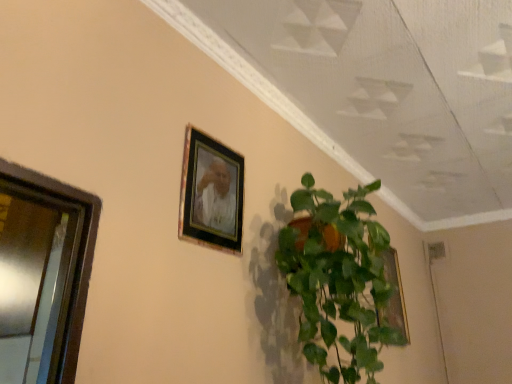
Find the location of a particular element. wooden frame at upper center, the 1th picture frame positioned from the top is located at coordinates (211, 193).

The image size is (512, 384). What are the coordinates of `metallic glass window at left` in the screenshot? It's located at (42, 274).

What do you see at coordinates (42, 274) in the screenshot? This screenshot has height=384, width=512. I see `metallic glass window at left` at bounding box center [42, 274].

Measure the distance between gold metallic picture frame at upper right, which appears as the second picture frame when viewed from the top, and camera.

The depth of gold metallic picture frame at upper right, which appears as the second picture frame when viewed from the top, is 2.12 meters.

At what (x,y) coordinates should I click in order to perform the action: click on wooden frame at upper center, the 2th picture frame from the right. Please return your answer as a coordinate pair (x, y). The width and height of the screenshot is (512, 384). Looking at the image, I should click on (211, 193).

Locate an element on the screen. picture frame above the metallic glass window at left (from the image's perspective) is located at coordinates (211, 193).

Is point (202, 187) in front of point (47, 289)?

No, (202, 187) is further to viewer.

Is wooden frame at upper center, the 1th picture frame positioned from the top, shorter than metallic glass window at left?

Yes, wooden frame at upper center, the 1th picture frame positioned from the top, is shorter than metallic glass window at left.

Does wooden frame at upper center, the 1th picture frame positioned from the top, touch metallic glass window at left?

No, wooden frame at upper center, the 1th picture frame positioned from the top, is not next to metallic glass window at left.

Based on the photo, between gold metallic picture frame at upper right, the 2th picture frame when ordered from left to right, and wooden frame at upper center, the 2th picture frame from the right, which one has larger width?

Wider between the two is wooden frame at upper center, the 2th picture frame from the right.

From the image's perspective, is gold metallic picture frame at upper right, the first picture frame viewed from the right, on wooden frame at upper center, the 2th picture frame from the right?

No.

Can you tell me how much gold metallic picture frame at upper right, which appears as the second picture frame when viewed from the top, and wooden frame at upper center, the 2th picture frame from the right, differ in facing direction?

The angular difference between gold metallic picture frame at upper right, which appears as the second picture frame when viewed from the top, and wooden frame at upper center, the 2th picture frame from the right, is 0.0299 degrees.

Between gold metallic picture frame at upper right, which is counted as the 2th picture frame, starting from the front, and wooden frame at upper center, which is the first picture frame from front to back, which one is positioned in front?

wooden frame at upper center, which is the first picture frame from front to back, is more forward.

How many degrees apart are the facing directions of green glossy plant at center and gold metallic picture frame at upper right, the first picture frame ordered from the bottom?

The facing directions of green glossy plant at center and gold metallic picture frame at upper right, the first picture frame ordered from the bottom, are 0.296 degrees apart.

Which object is further away from the camera taking this photo, green glossy plant at center or gold metallic picture frame at upper right, which is counted as the 2th picture frame, starting from the front?

gold metallic picture frame at upper right, which is counted as the 2th picture frame, starting from the front, is more distant.

Is green glossy plant at center wider than gold metallic picture frame at upper right, the first picture frame ordered from the bottom?

Indeed, green glossy plant at center has a greater width compared to gold metallic picture frame at upper right, the first picture frame ordered from the bottom.

Is green glossy plant at center taller than gold metallic picture frame at upper right, the first picture frame positioned from the back?

Yes, green glossy plant at center is taller than gold metallic picture frame at upper right, the first picture frame positioned from the back.

Is metallic glass window at left inside the boundaries of gold metallic picture frame at upper right, the 2th picture frame when ordered from left to right, or outside?

metallic glass window at left is outside gold metallic picture frame at upper right, the 2th picture frame when ordered from left to right.

Is metallic glass window at left oriented away from gold metallic picture frame at upper right, the first picture frame viewed from the right?

metallic glass window at left does not have its back to gold metallic picture frame at upper right, the first picture frame viewed from the right.

Which point is more distant from viewer, [42,228] or [395,286]?

Positioned behind is point [395,286].

Which point is more forward, (x=22, y=209) or (x=208, y=159)?

Point (x=22, y=209)

Measure the distance from metallic glass window at left to wooden frame at upper center, the 1th picture frame positioned from the left.

metallic glass window at left is 15.59 inches away from wooden frame at upper center, the 1th picture frame positioned from the left.

Is metallic glass window at left facing towards wooden frame at upper center, the 1th picture frame positioned from the top?

No, metallic glass window at left is not turned towards wooden frame at upper center, the 1th picture frame positioned from the top.

In the scene shown: From a real-world perspective, is metallic glass window at left on wooden frame at upper center, positioned as the 2th picture frame in back-to-front order?

No, from a real-world perspective, metallic glass window at left is not on top of wooden frame at upper center, positioned as the 2th picture frame in back-to-front order.

Is green glossy plant at center inside wooden frame at upper center, which is the first picture frame from front to back?

That's incorrect, green glossy plant at center is not inside wooden frame at upper center, which is the first picture frame from front to back.

Can you confirm if wooden frame at upper center, which is the first picture frame from front to back, is taller than green glossy plant at center?

No.

From a real-world perspective, relative to green glossy plant at center, is wooden frame at upper center, the 2th picture frame from the right, vertically above or below?

In terms of real-world spatial position, wooden frame at upper center, the 2th picture frame from the right, is above green glossy plant at center.

Can you tell me how much wooden frame at upper center, the 1th picture frame positioned from the left, and green glossy plant at center differ in facing direction?

The facing directions of wooden frame at upper center, the 1th picture frame positioned from the left, and green glossy plant at center are 0.267 degrees apart.

Can you tell me how much wooden frame at upper center, the 2th picture frame from the right, and gold metallic picture frame at upper right, which appears as the second picture frame when viewed from the top, differ in facing direction?

0.0299 degrees separate the facing orientations of wooden frame at upper center, the 2th picture frame from the right, and gold metallic picture frame at upper right, which appears as the second picture frame when viewed from the top.

Is wooden frame at upper center, which is the first picture frame from front to back, directly adjacent to gold metallic picture frame at upper right, the first picture frame ordered from the bottom?

They are not placed beside each other.

Can gold metallic picture frame at upper right, the first picture frame viewed from the right, be found inside wooden frame at upper center, the 1th picture frame positioned from the left?

That's incorrect, gold metallic picture frame at upper right, the first picture frame viewed from the right, is not inside wooden frame at upper center, the 1th picture frame positioned from the left.

Is wooden frame at upper center, the 1th picture frame positioned from the top, turned away from gold metallic picture frame at upper right, the first picture frame positioned from the back?

Result: No, wooden frame at upper center, the 1th picture frame positioned from the top, is not facing the opposite direction of gold metallic picture frame at upper right, the first picture frame positioned from the back.

At what (x,y) coordinates should I click in order to perform the action: click on window on the left of wooden frame at upper center, the 2th picture frame from the right. Please return your answer as a coordinate pair (x, y). This screenshot has width=512, height=384. Looking at the image, I should click on (42, 274).

Locate an element on the screen. This screenshot has height=384, width=512. picture frame in front of the gold metallic picture frame at upper right, the first picture frame viewed from the right is located at coordinates tap(211, 193).

Based on their spatial positions, is wooden frame at upper center, the 1th picture frame positioned from the top, or metallic glass window at left closer to green glossy plant at center?

wooden frame at upper center, the 1th picture frame positioned from the top, is positioned closer to the anchor green glossy plant at center.

From the image, which object appears to be nearer to green glossy plant at center, metallic glass window at left or gold metallic picture frame at upper right, the first picture frame positioned from the back?

metallic glass window at left.

Considering their positions, is gold metallic picture frame at upper right, which appears as the second picture frame when viewed from the top, positioned further to wooden frame at upper center, which is the first picture frame from front to back, than green glossy plant at center?

The object further to wooden frame at upper center, which is the first picture frame from front to back, is gold metallic picture frame at upper right, which appears as the second picture frame when viewed from the top.

Estimate the real-world distances between objects in this image. Which object is further from gold metallic picture frame at upper right, the 2th picture frame when ordered from left to right, metallic glass window at left or green glossy plant at center?

metallic glass window at left lies further to gold metallic picture frame at upper right, the 2th picture frame when ordered from left to right, than the other object.

When comparing their distances from green glossy plant at center, does gold metallic picture frame at upper right, the first picture frame viewed from the right, or wooden frame at upper center, which is the first picture frame from front to back, seem closer?

wooden frame at upper center, which is the first picture frame from front to back.

Based on their spatial positions, is green glossy plant at center or wooden frame at upper center, the 1th picture frame positioned from the left, further from gold metallic picture frame at upper right, the first picture frame viewed from the right?

The object further to gold metallic picture frame at upper right, the first picture frame viewed from the right, is wooden frame at upper center, the 1th picture frame positioned from the left.

Based on their spatial positions, is wooden frame at upper center, positioned as the 2th picture frame in back-to-front order, or green glossy plant at center further from metallic glass window at left?

green glossy plant at center.

Considering their positions, is wooden frame at upper center, the 1th picture frame positioned from the left, positioned further to green glossy plant at center than gold metallic picture frame at upper right, the first picture frame viewed from the right?

gold metallic picture frame at upper right, the first picture frame viewed from the right, is positioned further to the anchor green glossy plant at center.

The width and height of the screenshot is (512, 384). What are the coordinates of `picture frame situated between metallic glass window at left and green glossy plant at center from left to right` in the screenshot? It's located at (211, 193).

Where is `houseplant between metallic glass window at left and gold metallic picture frame at upper right, the first picture frame ordered from the bottom`? The height and width of the screenshot is (384, 512). houseplant between metallic glass window at left and gold metallic picture frame at upper right, the first picture frame ordered from the bottom is located at coordinates (339, 280).

The width and height of the screenshot is (512, 384). Identify the location of picture frame between green glossy plant at center and gold metallic picture frame at upper right, which is counted as the 2th picture frame, starting from the front, along the z-axis. (211, 193).

Where is `picture frame situated between metallic glass window at left and gold metallic picture frame at upper right, which appears as the second picture frame when viewed from the top, from left to right`? The image size is (512, 384). picture frame situated between metallic glass window at left and gold metallic picture frame at upper right, which appears as the second picture frame when viewed from the top, from left to right is located at coordinates (211, 193).